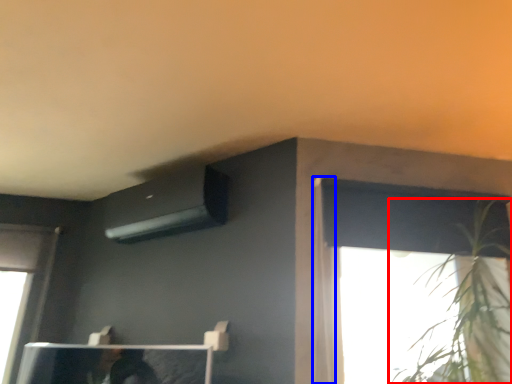
Question: Which of the following is the closest to the observer, houseplant (highlighted by a red box) or curtain (highlighted by a blue box)?

Choices:
 (A) houseplant
 (B) curtain

Answer: (A)